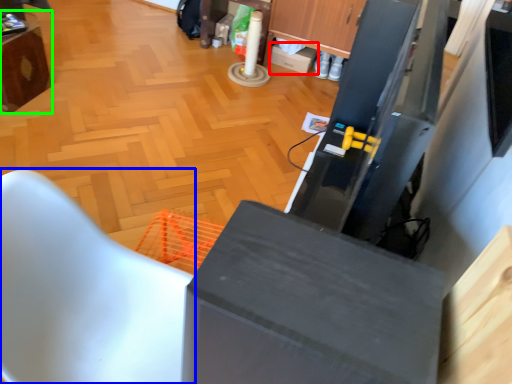
Question: Which object is the farthest from box (highlighted by a red box)? Choose among these: furniture (highlighted by a blue box) or furniture (highlighted by a green box).

Choices:
 (A) furniture
 (B) furniture

Answer: (A)